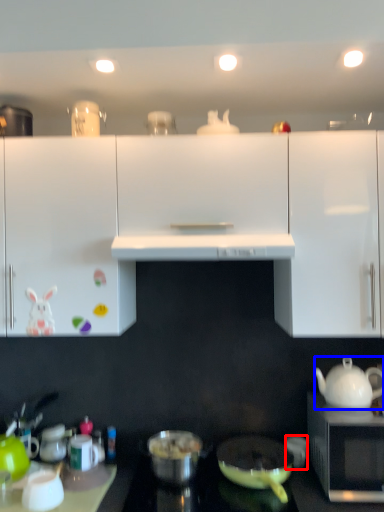
Question: Which object is further to the camera taking this photo, coffee cup (highlighted by a red box) or teapot (highlighted by a blue box)?

Choices:
 (A) coffee cup
 (B) teapot

Answer: (A)